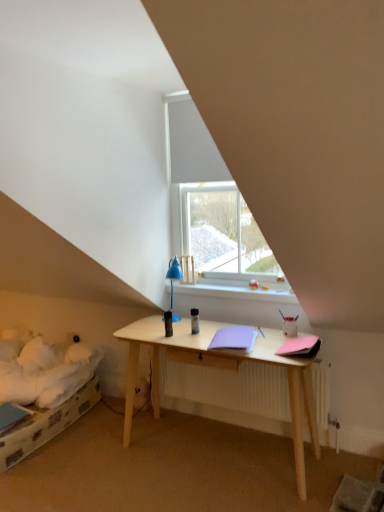
Question: Considering the positions of transparent glass window at center and white plastic window sill at center in the image, is transparent glass window at center taller or shorter than white plastic window sill at center?

Choices:
 (A) short
 (B) tall

Answer: (B)

Question: Is point (185, 140) positioned closer to the camera than point (238, 288)?

Choices:
 (A) closer
 (B) farther

Answer: (B)

Question: Estimate the real-world distances between objects in this image. Which object is farther from the pink matte notebook at right, which ranks as the second notebook in left-to-right order?

Choices:
 (A) white plastic window sill at center
 (B) transparent glass window at center
 (C) lavender matte notebook at center, positioned as the first notebook in left-to-right order

Answer: (B)

Question: Estimate the real-world distances between objects in this image. Which object is closer to the transparent glass window at center?

Choices:
 (A) pink matte notebook at right, positioned as the first notebook in right-to-left order
 (B) white plastic window sill at center
 (C) lavender matte notebook at center, positioned as the first notebook in left-to-right order

Answer: (B)